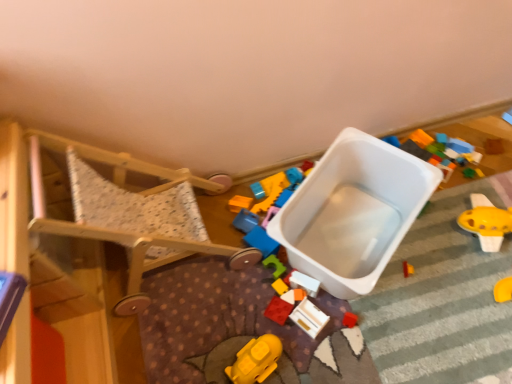
The image size is (512, 384). In order to click on vacant space in front of white plastic toy at center, the 3th toy positioned from the right in this screenshot , I will do `click(323, 344)`.